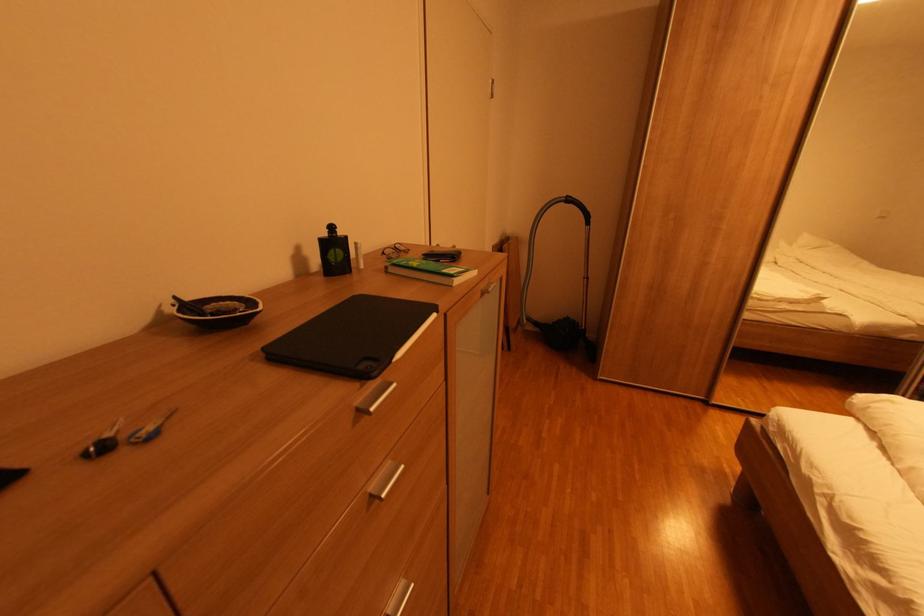
Where would you twist the black bottle cap? Please return your answer as a coordinate pair (x, y).

(100, 447)